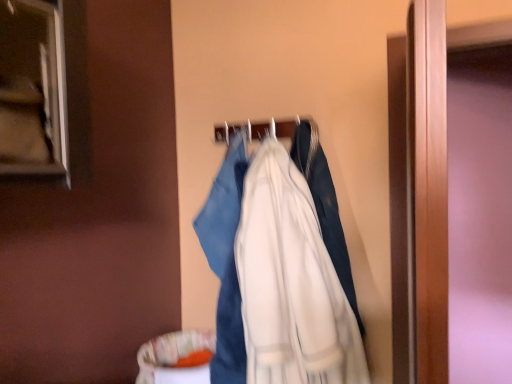
Question: Is there a large distance between white fabric hanger at center and white cotton coat at center?

Choices:
 (A) no
 (B) yes

Answer: (A)

Question: Is white fabric hanger at center oriented towards white cotton coat at center?

Choices:
 (A) no
 (B) yes

Answer: (B)

Question: Can you confirm if white fabric hanger at center is shorter than white cotton coat at center?

Choices:
 (A) no
 (B) yes

Answer: (B)

Question: From a real-world perspective, is white fabric hanger at center over white cotton coat at center?

Choices:
 (A) yes
 (B) no

Answer: (A)

Question: Is white fabric hanger at center further to camera compared to white cotton coat at center?

Choices:
 (A) no
 (B) yes

Answer: (B)

Question: Is white fabric hanger at center facing away from white cotton coat at center?

Choices:
 (A) yes
 (B) no

Answer: (B)

Question: Would you consider white cotton coat at center to be distant from white fabric hanger at center?

Choices:
 (A) yes
 (B) no

Answer: (B)

Question: Is white fabric hanger at center inside white cotton coat at center?

Choices:
 (A) yes
 (B) no

Answer: (B)

Question: Is the depth of white cotton coat at center less than that of white fabric hanger at center?

Choices:
 (A) yes
 (B) no

Answer: (A)

Question: Does white cotton coat at center have a larger size compared to white fabric hanger at center?

Choices:
 (A) yes
 (B) no

Answer: (A)

Question: Does white cotton coat at center come behind white fabric hanger at center?

Choices:
 (A) no
 (B) yes

Answer: (A)

Question: From the image's perspective, is white cotton coat at center located beneath white fabric hanger at center?

Choices:
 (A) yes
 (B) no

Answer: (A)

Question: From the image's perspective, is white cotton coat at center located above or below white fabric hanger at center?

Choices:
 (A) above
 (B) below

Answer: (B)